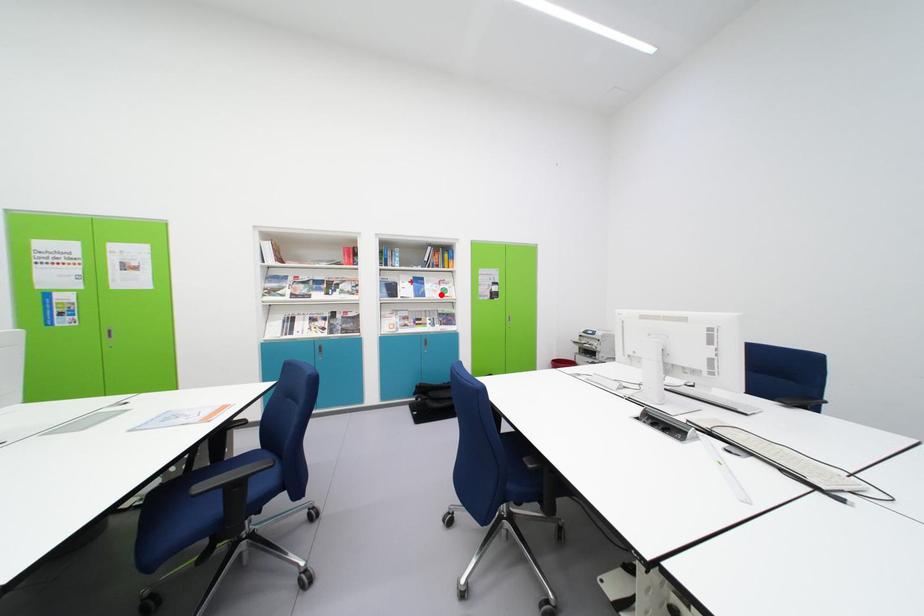
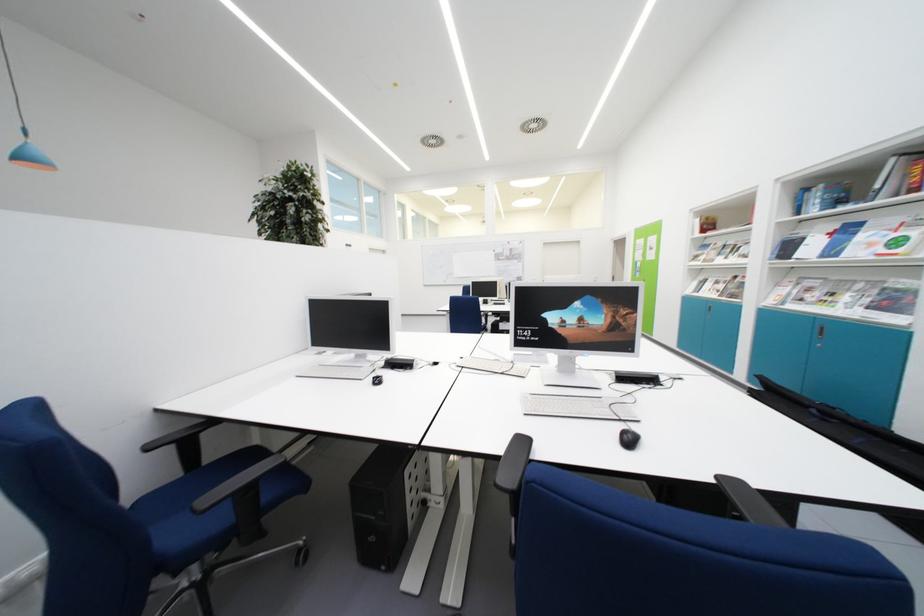
Find the pixel in the second image that matches the highlighted location in the first image.

(878, 249)